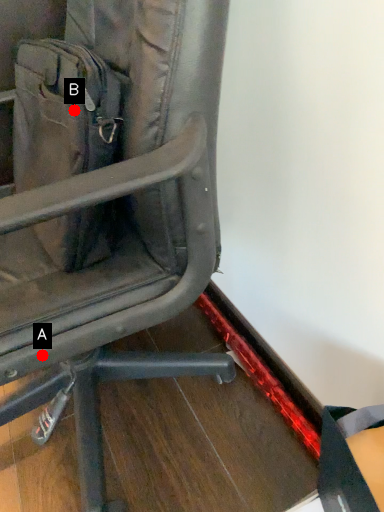
Question: Two points are circled on the image, labeled by A and B beside each circle. Which point is closer to the camera?

Choices:
 (A) A is closer
 (B) B is closer

Answer: (A)